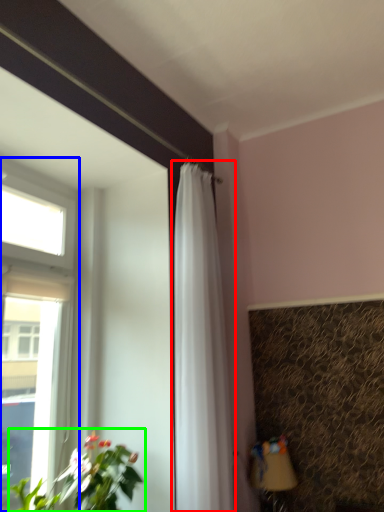
Question: Which object is the closest to the curtain (highlighted by a red box)? Choose among these: window (highlighted by a blue box) or houseplant (highlighted by a green box).

Choices:
 (A) window
 (B) houseplant

Answer: (B)